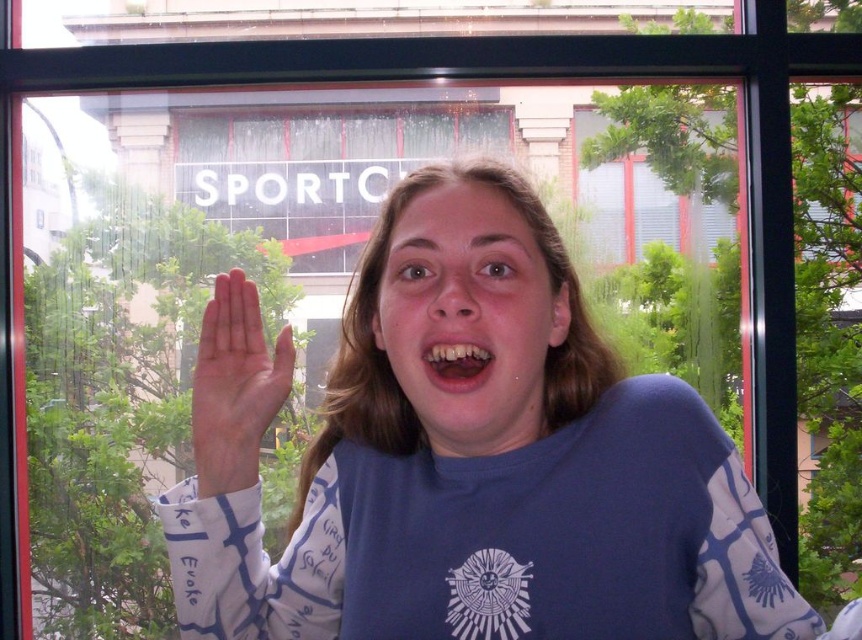
Does matte skin face at center have a greater height compared to yellowish matte teeth at center?

Yes.

Can you confirm if matte skin face at center is thinner than yellowish matte teeth at center?

In fact, matte skin face at center might be wider than yellowish matte teeth at center.

Does point (398, 308) lie in front of point (450, 342)?

No, (398, 308) is further to viewer.

What are the coordinates of `matte skin face at center` in the screenshot? It's located at (467, 317).

Who is shorter, blue cotton shirt at center or yellowish matte teeth at center?

Standing shorter between the two is yellowish matte teeth at center.

Is point (565, 522) in front of point (475, 344)?

No, (565, 522) is behind (475, 344).

Is point (454, 189) positioned behind point (472, 378)?

Yes.

At what (x,y) coordinates should I click in order to perform the action: click on blue cotton shirt at center. Please return your answer as a coordinate pair (x, y). This screenshot has height=640, width=862. Looking at the image, I should click on (467, 460).

Does blue cotton shirt at center appear on the left side of matte skin face at center?

Incorrect, blue cotton shirt at center is not on the left side of matte skin face at center.

Between blue cotton shirt at center and matte skin face at center, which one has less height?

matte skin face at center is shorter.

Measure the distance between blue cotton shirt at center and camera.

The distance of blue cotton shirt at center from camera is 34.29 inches.

You are a GUI agent. You are given a task and a screenshot of the screen. Output one action in this format:
    pyautogui.click(x=<x>, y=<y>)
    Task: Click on the blue cotton shirt at center
    This screenshot has width=862, height=640.
    Given the screenshot: What is the action you would take?
    [x=467, y=460]